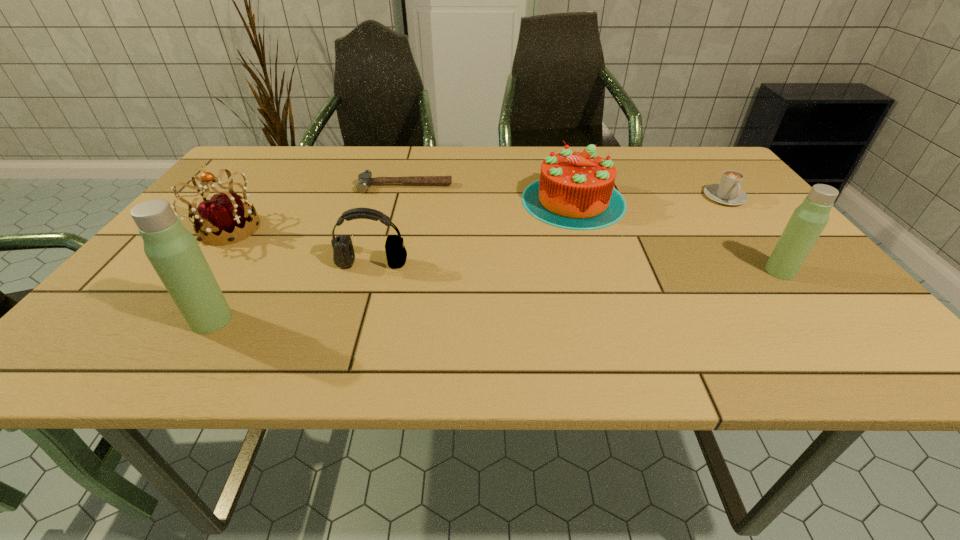
To make them evenly spaced by inserting another thermos_bottle among them, please locate a vacant spot for this new thermos_bottle. Please provide its 2D coordinates. Your answer should be formatted as a tuple, i.e. [(x, y)], where the tuple contains the x and y coordinates of a point satisfying the conditions above.

[(513, 294)]